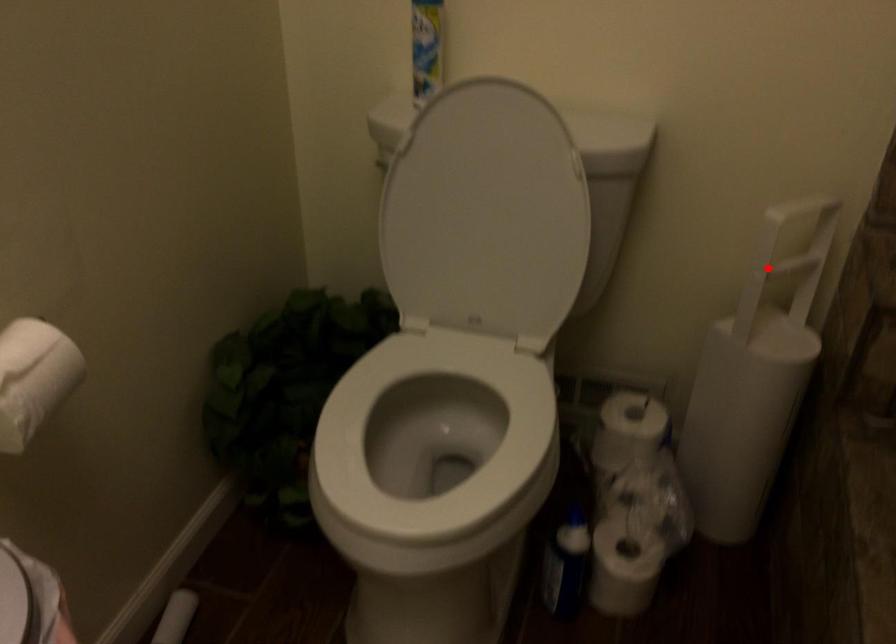
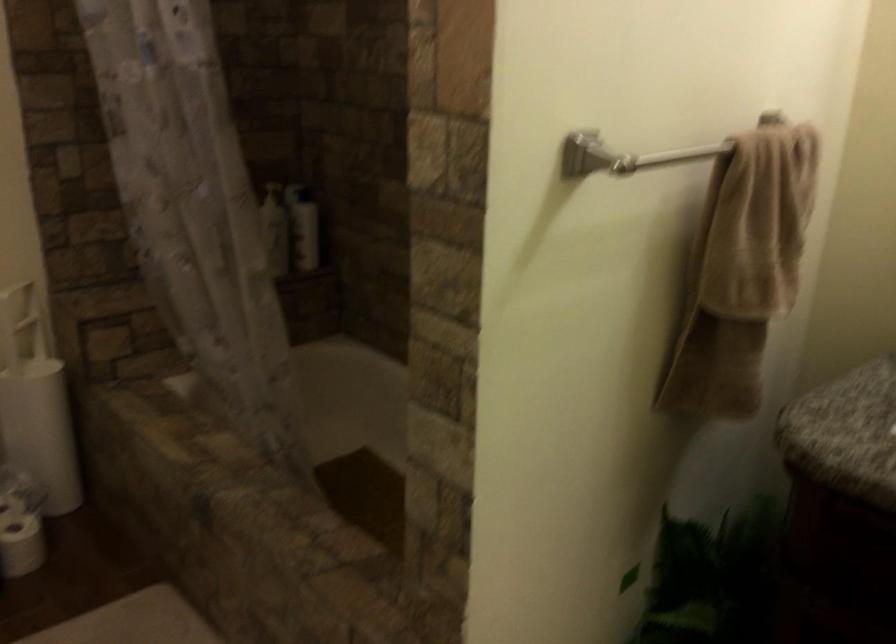
The point at the highlighted location is marked in the first image. Where is the corresponding point in the second image?

(20, 323)